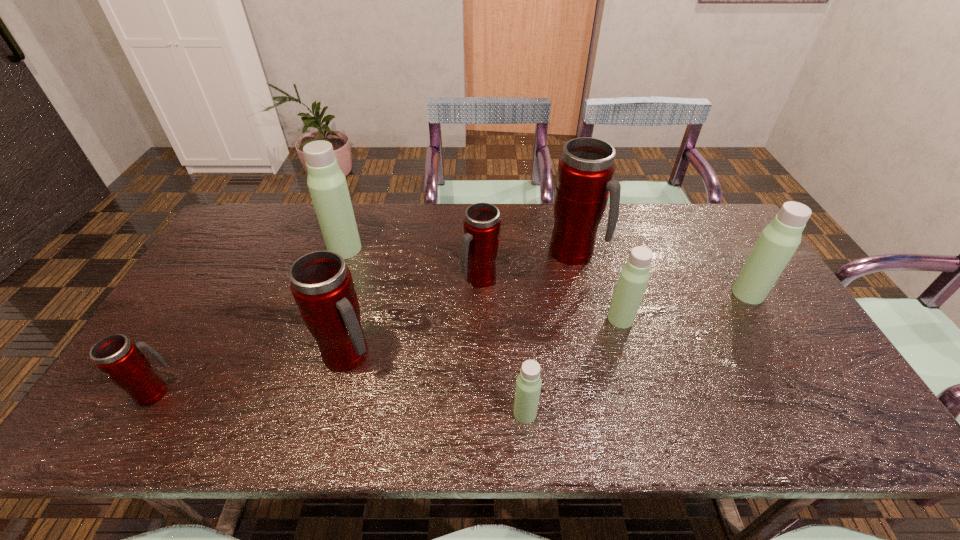
You are a GUI agent. You are given a task and a screenshot of the screen. Output one action in this format:
    pyautogui.click(x=<x>, y=<y>)
    Task: Click on the vacant space at the right edge
    
    Given the screenshot: What is the action you would take?
    pyautogui.click(x=764, y=310)

You are a GUI agent. You are given a task and a screenshot of the screen. Output one action in this format:
    pyautogui.click(x=<x>, y=<y>)
    Task: Click on the free space at the far right corner of the desktop
    
    Given the screenshot: What is the action you would take?
    pyautogui.click(x=724, y=213)

The image size is (960, 540). I want to click on free spot between the fifth thermos bottle from left to right and the fifth object from right to left, so click(x=503, y=346).

At what (x,y) coordinates should I click in order to perform the action: click on free spot between the second biggest light thermos bottle and the second light thermos bottle from right to left. Please return your answer as a coordinate pair (x, y). Image resolution: width=960 pixels, height=540 pixels. Looking at the image, I should click on (684, 306).

Image resolution: width=960 pixels, height=540 pixels. Find the location of `free space between the third smallest red thermos bottle and the rightmost object`. free space between the third smallest red thermos bottle and the rightmost object is located at coordinates (548, 325).

Identify the location of empty space that is in between the third farthest light thermos bottle and the second biggest light thermos bottle. (684, 306).

What are the coordinates of `vacant space that is in between the rightmost object and the fifth object from left to right` in the screenshot? It's located at (636, 353).

I want to click on free point between the fifth object from right to left and the second farthest light thermos bottle, so click(x=614, y=286).

In order to click on vacant point located between the rightmost object and the third farthest light thermos bottle in this screenshot , I will do `click(684, 306)`.

At what (x,y) coordinates should I click in order to perform the action: click on unoccupied position between the biggest red thermos bottle and the second light thermos bottle from right to left. Please return your answer as a coordinate pair (x, y). This screenshot has height=540, width=960. Looking at the image, I should click on (597, 286).